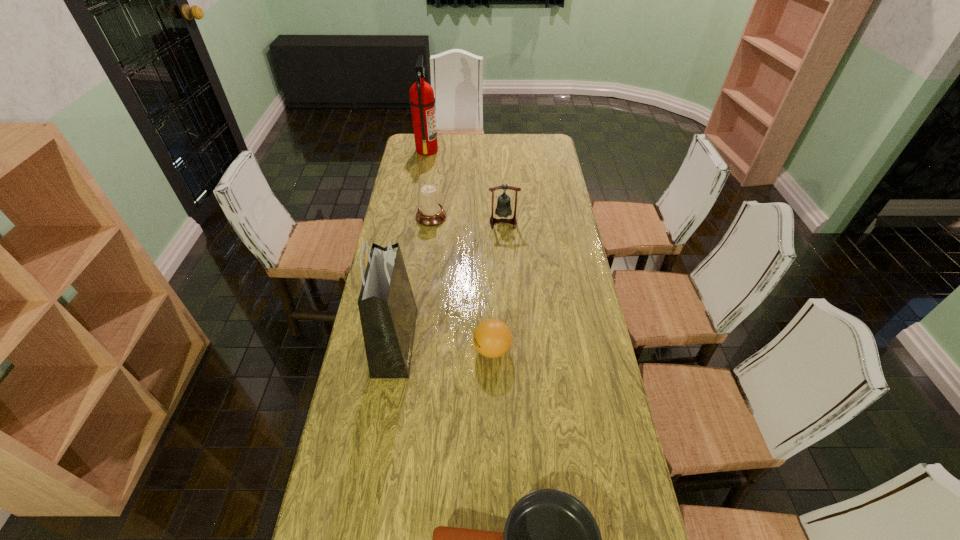
Where is `fire extinguisher`? fire extinguisher is located at coordinates point(422,100).

Where is `shopping bag`? This screenshot has width=960, height=540. shopping bag is located at coordinates (388, 312).

Identify the location of the third tallest object. (503, 209).

I want to click on the third shortest object, so click(x=430, y=213).

Locate an element on the screen. ping-pong ball is located at coordinates (492, 338).

Identify the location of free spot located 0.210m on the side of the fire extinguisher near the handle. The width and height of the screenshot is (960, 540). (480, 150).

Image resolution: width=960 pixels, height=540 pixels. Identify the location of vacant space located on the front with handles of the shopping bag. (539, 342).

Where is `vacant area situated on the left of the bell`? The height and width of the screenshot is (540, 960). vacant area situated on the left of the bell is located at coordinates (402, 222).

At what (x,y) coordinates should I click in order to perform the action: click on vacant position located on the right of the third shortest object. Please return your answer as a coordinate pair (x, y). The height and width of the screenshot is (540, 960). Looking at the image, I should click on (532, 217).

Locate an element on the screen. The width and height of the screenshot is (960, 540). free spot located 0.140m on the side with brand of the ping-pong ball is located at coordinates (429, 350).